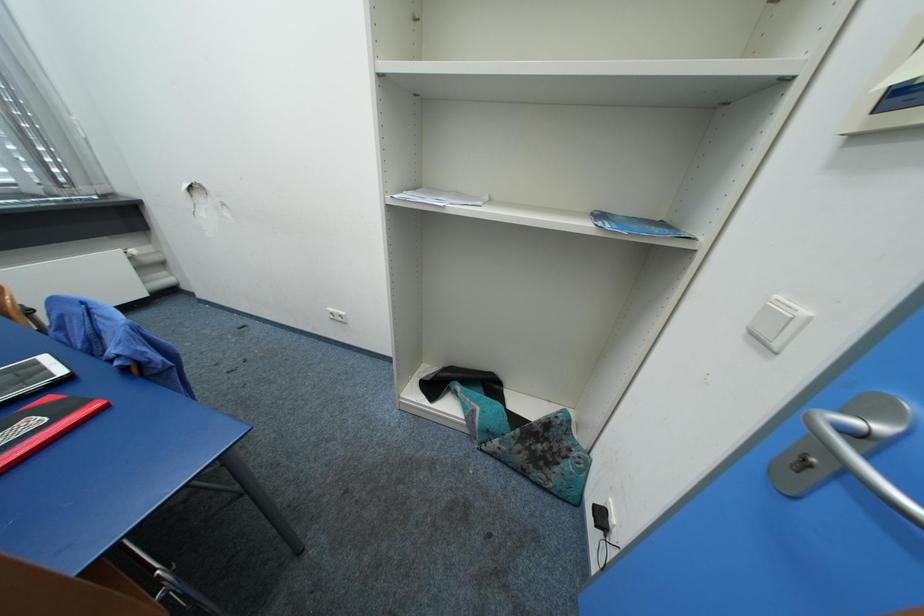
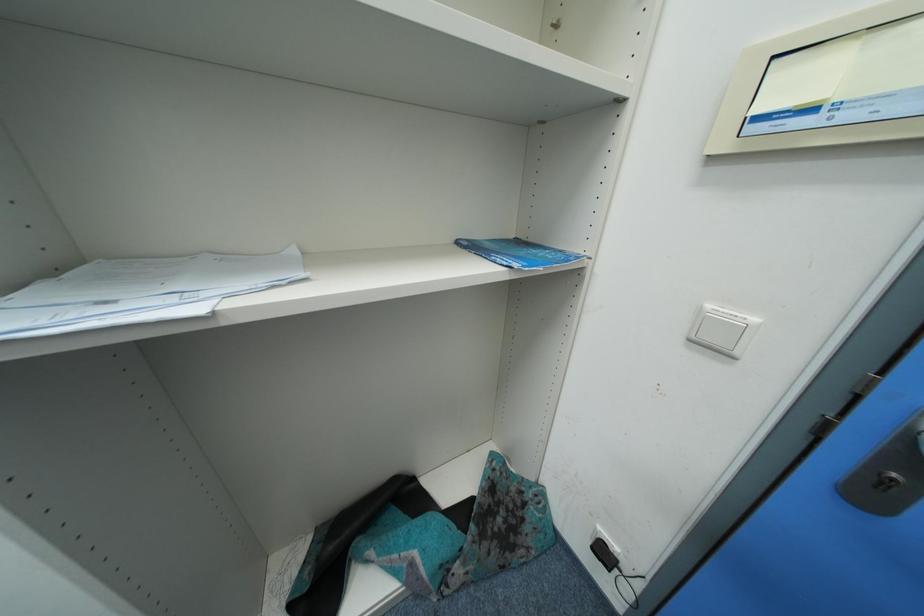
Question: The first image is from the beginning of the video and the second image is from the end. How did the camera likely rotate when shooting the video?

Choices:
 (A) Left
 (B) Right
 (C) Up
 (D) Down

Answer: (B)